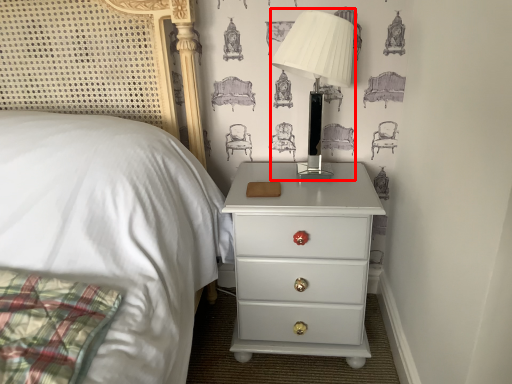
Question: Observing the image, what is the correct spatial positioning of table lamp (annotated by the red box) in reference to nightstand?

Choices:
 (A) right
 (B) left

Answer: (A)